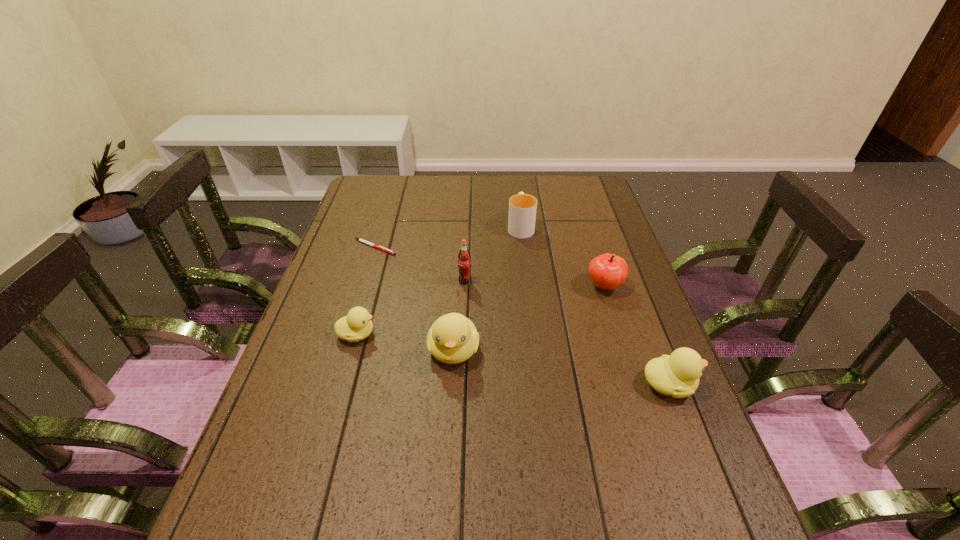
If equal spacing is desired by inserting an extra duckling among them, please point out a free spot for this new duckling. Please provide its 2D coordinates. Your answer should be formatted as a tuple, i.e. [(x, y)], where the tuple contains the x and y coordinates of a point satisfying the conditions above.

[(558, 367)]